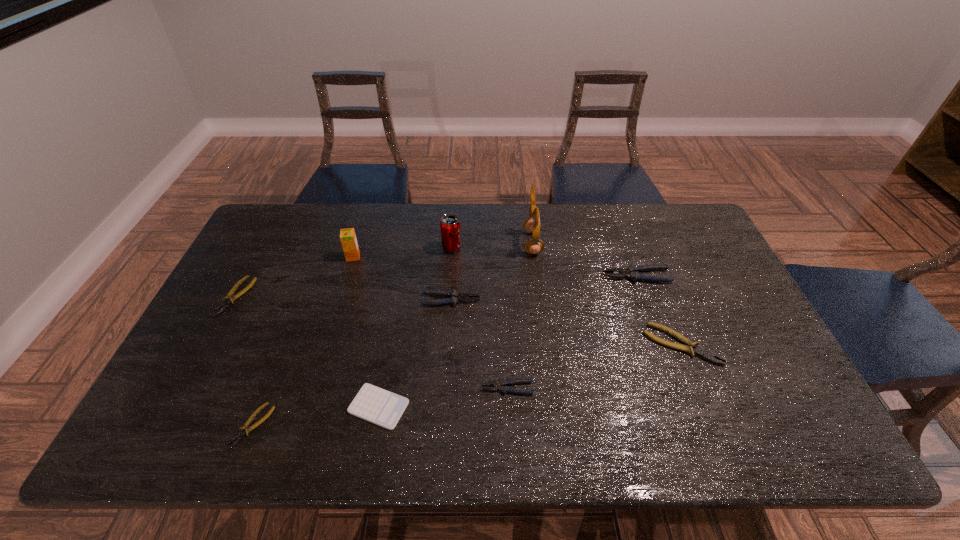
Locate an element on the screen. vacant space located 0.070m at the gripping part of the smallest gray pliers is located at coordinates (453, 388).

Identify the location of vacant position located 0.120m on the right of the second shortest pliers. (x=290, y=296).

Locate an element on the screen. The height and width of the screenshot is (540, 960). vacant space located on the left of the calculator is located at coordinates (295, 407).

At what (x,y) coordinates should I click in order to perform the action: click on vacant region located on the back of the second yellow pliers from right to left. Please return your answer as a coordinate pair (x, y). The width and height of the screenshot is (960, 540). Looking at the image, I should click on (295, 316).

Find the location of a particular element. earphone that is at the far edge is located at coordinates (532, 225).

This screenshot has width=960, height=540. I want to click on soda can present at the far edge, so click(x=450, y=225).

Where is `calculator that is at the near edge`? calculator that is at the near edge is located at coordinates (384, 408).

Image resolution: width=960 pixels, height=540 pixels. Find the location of `pliers that is at the near edge`. pliers that is at the near edge is located at coordinates (245, 429).

Identify the location of object present at the left edge. 229,298.

Where is `object present at the right edge`? The width and height of the screenshot is (960, 540). object present at the right edge is located at coordinates (706, 354).